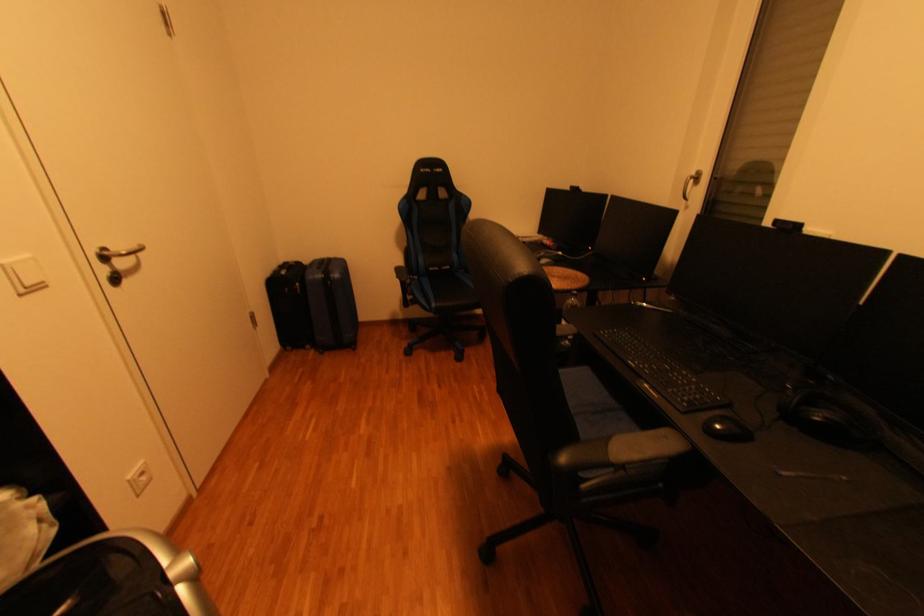
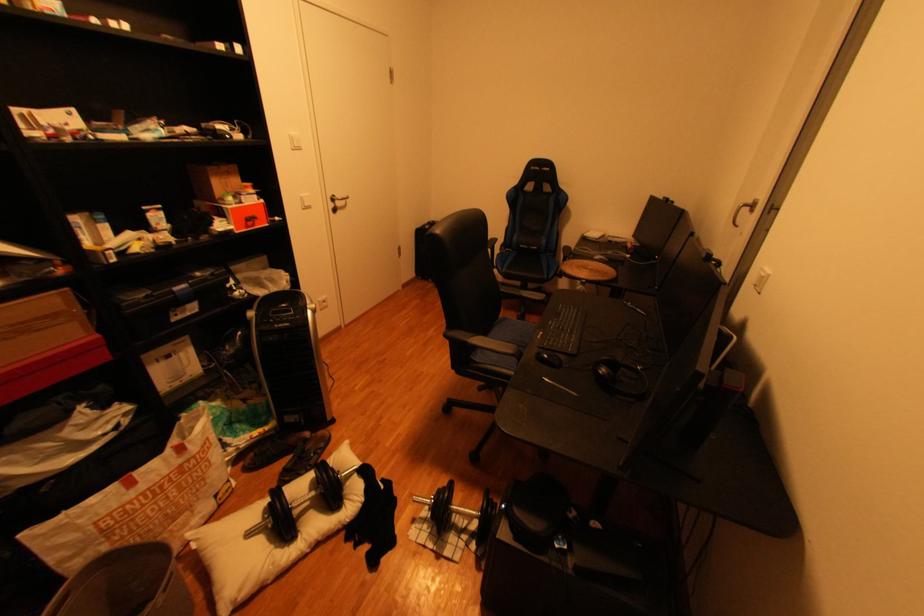
The point at (x=114, y=249) is marked in the first image. Where is the corresponding point in the second image?

(345, 197)